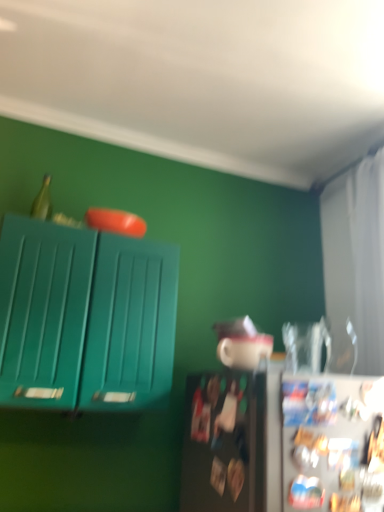
What do you see at coordinates (84, 318) in the screenshot?
I see `teal matte cabinet at upper left` at bounding box center [84, 318].

I want to click on teal matte cabinet at upper left, so click(84, 318).

Where is `teal matte cabinet at upper left`? The width and height of the screenshot is (384, 512). teal matte cabinet at upper left is located at coordinates (84, 318).